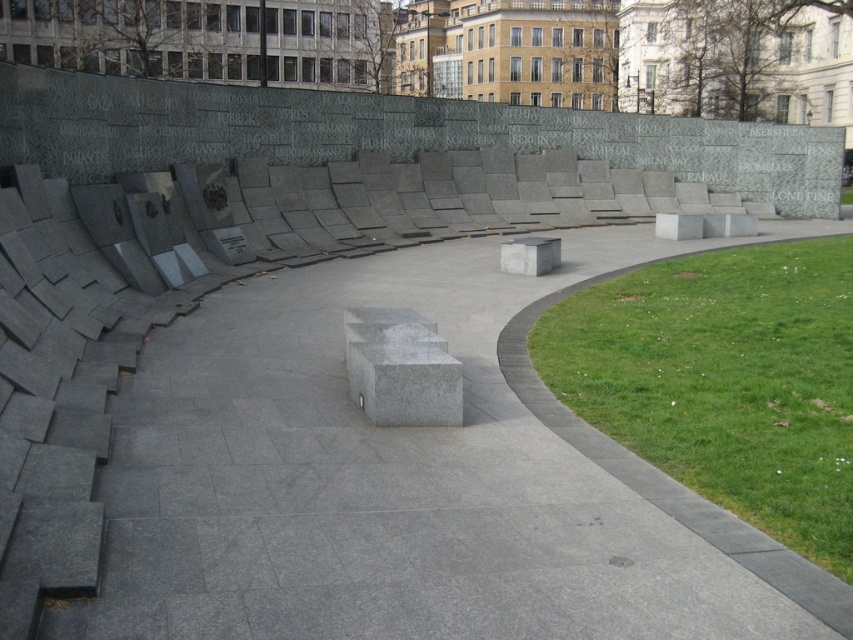
Who is shorter, gray concrete pavement at center or green grass at lower right?

With less height is gray concrete pavement at center.

Between point (135, 502) and point (664, 456), which one is positioned behind?

Positioned behind is point (664, 456).

Find the location of a particular element. This screenshot has width=853, height=640. gray concrete pavement at center is located at coordinates (x=399, y=477).